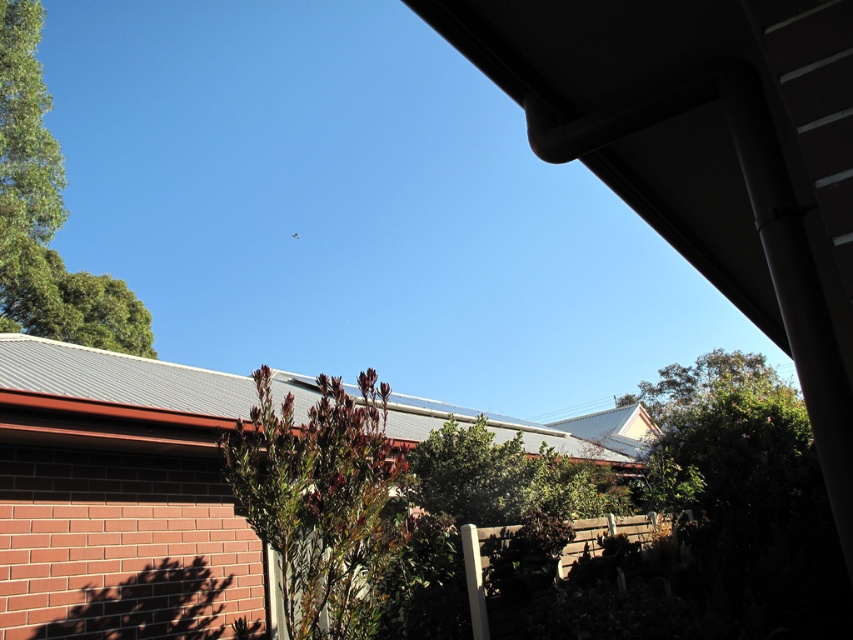
You are standing in the suburban scene and want to take a photo. There are two points marked in the image, point 1 at coordinates point [381,412] and point 2 at coordinates point [18,93]. Which point is closer to you?

Point [381,412] is closer to the camera than point [18,93], so point 1 is closer to you.

You are standing in the suburban scene described. If you want to walk towards the green leafy bush at center, which direction should you move relative to your current position?

The green leafy bush at center is located at coordinates point [321,500], so you should move towards the center of the scene to reach it.